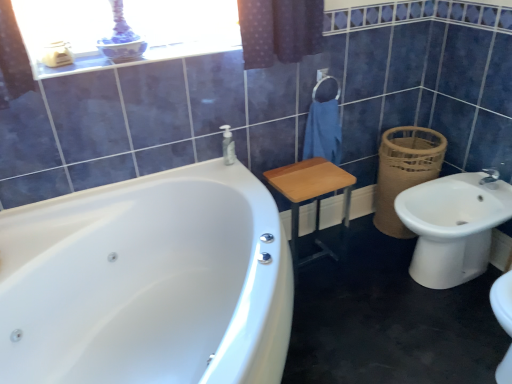
This screenshot has height=384, width=512. Find the location of `vacant space situated on the left part of white glossy sink at lower right`. vacant space situated on the left part of white glossy sink at lower right is located at coordinates (361, 279).